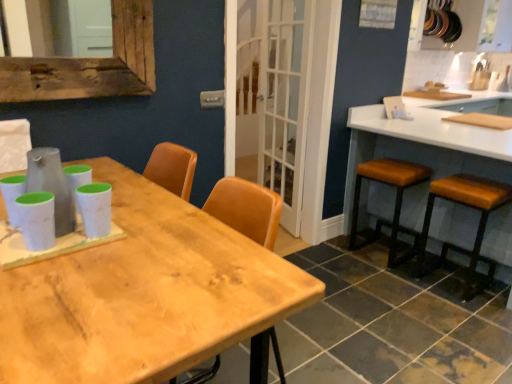
You are a GUI agent. You are given a task and a screenshot of the screen. Output one action in this format:
    pyautogui.click(x=<x>, y=<y>)
    Task: Click on the free space above brown leather stool at right, which is the 2th stool in right-to-left order (from a real-world perspective)
    Image resolution: width=512 pixels, height=384 pixels.
    Given the screenshot: What is the action you would take?
    pyautogui.click(x=386, y=170)